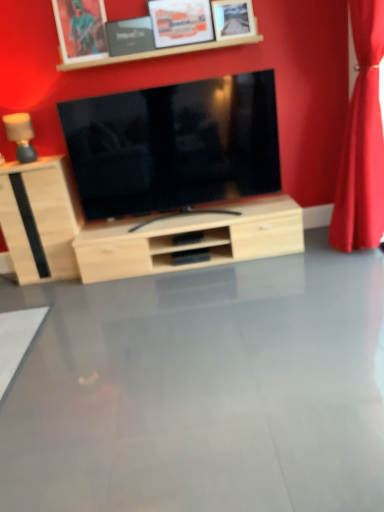
Locate an element on the screen. This screenshot has height=512, width=384. wooden picture frame at upper center, the 2th picture frame from the right is located at coordinates (181, 22).

Measure the distance between point (x=371, y=126) and camera.

Point (x=371, y=126) and camera are 2.63 meters apart.

Image resolution: width=384 pixels, height=512 pixels. In order to click on red velvet curtain at right in this screenshot , I will do `click(362, 140)`.

What do you see at coordinates (40, 218) in the screenshot? Image resolution: width=384 pixels, height=512 pixels. I see `light wood cabinet at left` at bounding box center [40, 218].

What do you see at coordinates (174, 145) in the screenshot? This screenshot has width=384, height=512. I see `matte black tv at center` at bounding box center [174, 145].

Image resolution: width=384 pixels, height=512 pixels. I want to click on matte black tv at center, so click(x=174, y=145).

Where is `brushed metal picture frame at upper center, the first picture frame from the left`? brushed metal picture frame at upper center, the first picture frame from the left is located at coordinates (81, 29).

Looking at this image, is matte wood lamp at left at the back of matte black picture frame at upper center, the third picture frame from the right?

No, matte black picture frame at upper center, the third picture frame from the right, is not facing away from matte wood lamp at left.

From a real-world perspective, is matte black picture frame at upper center, the third picture frame from the right, located higher than matte wood lamp at left?

Indeed, from a real-world perspective, matte black picture frame at upper center, the third picture frame from the right, stands above matte wood lamp at left.

Is matte black picture frame at upper center, the third picture frame from the right, not within matte wood lamp at left?

matte black picture frame at upper center, the third picture frame from the right, lies outside matte wood lamp at left's area.

From the image's perspective, does matte black picture frame at upper center, the third picture frame from the right, appear lower than matte wood lamp at left?

No, from the image's perspective, matte black picture frame at upper center, the third picture frame from the right, is not beneath matte wood lamp at left.

Can you confirm if wooden frame at upper center is positioned to the left of brushed metal picture frame at upper center, which appears as the 4th picture frame when viewed from the right?

No.

From the image's perspective, is wooden frame at upper center above brushed metal picture frame at upper center, the first picture frame from the left?

No, from the image's perspective, wooden frame at upper center is not above brushed metal picture frame at upper center, the first picture frame from the left.

Could brushed metal picture frame at upper center, the first picture frame from the left, be considered to be inside wooden frame at upper center?

That's correct, brushed metal picture frame at upper center, the first picture frame from the left, is inside wooden frame at upper center.

Is wooden frame at upper center positioned behind brushed metal picture frame at upper center, the first picture frame from the left?

No, the depth of wooden frame at upper center is less than that of brushed metal picture frame at upper center, the first picture frame from the left.

Who is shorter, wooden frame at upper center or matte black picture frame at upper center, acting as the 2th picture frame starting from the left?

Standing shorter between the two is wooden frame at upper center.

At what (x,y) coordinates should I click in order to perform the action: click on shelf in front of the matte black picture frame at upper center, acting as the 2th picture frame starting from the left. Please return your answer as a coordinate pair (x, y). This screenshot has height=512, width=384. Looking at the image, I should click on (161, 52).

Considering the relative sizes of wooden frame at upper center and matte black picture frame at upper center, acting as the 2th picture frame starting from the left, in the image provided, is wooden frame at upper center thinner than matte black picture frame at upper center, acting as the 2th picture frame starting from the left,?

In fact, wooden frame at upper center might be wider than matte black picture frame at upper center, acting as the 2th picture frame starting from the left.

Is wooden frame at upper center in contact with matte black picture frame at upper center, the third picture frame from the right?

No, wooden frame at upper center is not next to matte black picture frame at upper center, the third picture frame from the right.

Does light wood cabinet at left turn towards brushed metal picture frame at upper center, which appears as the 4th picture frame when viewed from the right?

No.

Is point (41, 178) positioned in front of point (97, 35)?

No, (41, 178) is further to viewer.

Can you tell me how much brushed metal picture frame at upper center, which appears as the 4th picture frame when viewed from the right, and light wood cabinet at left differ in facing direction?

brushed metal picture frame at upper center, which appears as the 4th picture frame when viewed from the right, and light wood cabinet at left are facing 1.04 degrees away from each other.

Which of these two, brushed metal picture frame at upper center, which appears as the 4th picture frame when viewed from the right, or light wood cabinet at left, stands shorter?

With less height is brushed metal picture frame at upper center, which appears as the 4th picture frame when viewed from the right.

Considering the positions of objects brushed metal picture frame at upper center, which appears as the 4th picture frame when viewed from the right, and light wood cabinet at left in the image provided, who is more to the right, brushed metal picture frame at upper center, which appears as the 4th picture frame when viewed from the right, or light wood cabinet at left?

brushed metal picture frame at upper center, which appears as the 4th picture frame when viewed from the right.

Considering the relative sizes of brushed metal picture frame at upper center, which appears as the 4th picture frame when viewed from the right, and light wood cabinet at left in the image provided, is brushed metal picture frame at upper center, which appears as the 4th picture frame when viewed from the right, wider than light wood cabinet at left?

No, brushed metal picture frame at upper center, which appears as the 4th picture frame when viewed from the right, is not wider than light wood cabinet at left.

Is red velvet curtain at right far from matte wood lamp at left?

Indeed, red velvet curtain at right is not near matte wood lamp at left.

Does red velvet curtain at right appear on the left side of matte wood lamp at left?

In fact, red velvet curtain at right is to the right of matte wood lamp at left.

How much distance is there between red velvet curtain at right and matte wood lamp at left?

The distance of red velvet curtain at right from matte wood lamp at left is 7.44 feet.

Considering the relative sizes of red velvet curtain at right and matte wood lamp at left in the image provided, is red velvet curtain at right thinner than matte wood lamp at left?

No.

Considering the relative positions of matte black picture frame at upper center, acting as the 2th picture frame starting from the left, and wooden frame at upper center in the image provided, is matte black picture frame at upper center, acting as the 2th picture frame starting from the left, in front of wooden frame at upper center?

No, it is behind wooden frame at upper center.

Can you confirm if matte black picture frame at upper center, acting as the 2th picture frame starting from the left, is shorter than wooden frame at upper center?

Incorrect, the height of matte black picture frame at upper center, acting as the 2th picture frame starting from the left, does not fall short of that of wooden frame at upper center.

In order to click on picture frame that is the 1st one when counting forward from the matte wood lamp at left in this screenshot , I will do `click(130, 36)`.

From the wooden frame at upper center, count 3rd picture frames backward and point to it. Please provide its 2D coordinates.

[(81, 29)]

Considering their positions, is matte black picture frame at upper center, the third picture frame from the right, positioned further to matte black tv at center than matte wood lamp at left?

matte wood lamp at left is positioned further to the anchor matte black tv at center.

When comparing their distances from brushed metal picture frame at upper center, which appears as the 4th picture frame when viewed from the right, does matte black picture frame at upper center, the third picture frame from the right, or light wood cabinet at left seem further?

The object further to brushed metal picture frame at upper center, which appears as the 4th picture frame when viewed from the right, is light wood cabinet at left.

Based on their spatial positions, is brushed metal picture frame at upper center, which appears as the 4th picture frame when viewed from the right, or matte black tv at center closer to wooden frame at upper center?

brushed metal picture frame at upper center, which appears as the 4th picture frame when viewed from the right.

When comparing their distances from wooden frame at upper center, does brushed metal picture frame at upper center, which appears as the 4th picture frame when viewed from the right, or matte wood lamp at left seem further?

matte wood lamp at left lies further to wooden frame at upper center than the other object.

Which object lies further to the anchor point matte black tv at center, red velvet curtain at right or light wood cabinet at left?

red velvet curtain at right is positioned further to the anchor matte black tv at center.

Considering their positions, is brushed metal picture frame at upper center, the first picture frame from the left, positioned further to wooden picture frame at upper center, the first picture frame positioned from the right, than light wood cabinet at left?

light wood cabinet at left is further to wooden picture frame at upper center, the first picture frame positioned from the right.

Estimate the real-world distances between objects in this image. Which object is closer to matte wood lamp at left, red velvet curtain at right or matte black tv at center?

The object closer to matte wood lamp at left is matte black tv at center.

When comparing their distances from red velvet curtain at right, does matte black picture frame at upper center, acting as the 2th picture frame starting from the left, or wooden frame at upper center seem further?

Among the two, matte black picture frame at upper center, acting as the 2th picture frame starting from the left, is located further to red velvet curtain at right.

This screenshot has height=512, width=384. I want to click on television located between matte black picture frame at upper center, acting as the 2th picture frame starting from the left, and red velvet curtain at right in the left-right direction, so click(174, 145).

Find the location of a particular element. television situated between brushed metal picture frame at upper center, which appears as the 4th picture frame when viewed from the right, and wooden picture frame at upper center, the first picture frame positioned from the right, from left to right is located at coordinates (174, 145).

Locate an element on the screen. The height and width of the screenshot is (512, 384). television situated between matte wood lamp at left and wooden picture frame at upper center, the 2th picture frame from the right, from left to right is located at coordinates (174, 145).

You are a GUI agent. You are given a task and a screenshot of the screen. Output one action in this format:
    pyautogui.click(x=<x>, y=<y>)
    Task: Click on the cabinetry between matte wood lamp at left and matte black tv at center from left to right
    The width and height of the screenshot is (384, 512).
    Given the screenshot: What is the action you would take?
    pyautogui.click(x=40, y=218)